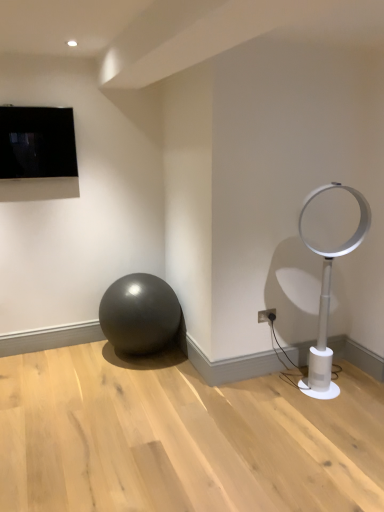
Image resolution: width=384 pixels, height=512 pixels. Find the location of `free spot below white plastic fan at right (from a real-world perspective)`. free spot below white plastic fan at right (from a real-world perspective) is located at coordinates (344, 386).